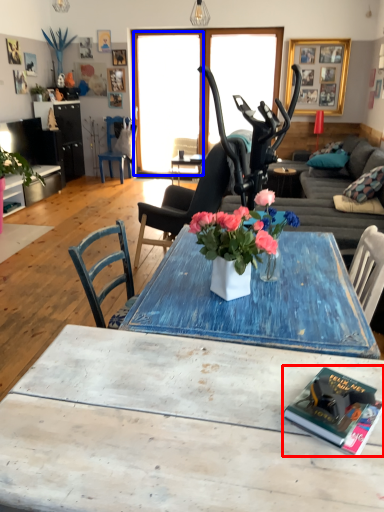
Question: Which of the following is the closest to the observer, book (highlighted by a red box) or window screen (highlighted by a blue box)?

Choices:
 (A) book
 (B) window screen

Answer: (A)